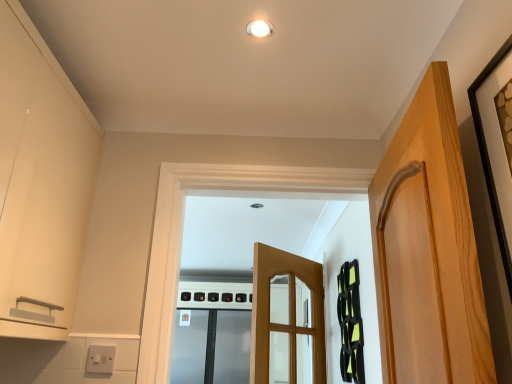
You are a GUI agent. You are given a task and a screenshot of the screen. Output one action in this format:
    pyautogui.click(x=<x>, y=<y>)
    Task: Click on the free space in front of white glossy light fixture at upper center
    This screenshot has height=384, width=512.
    Given the screenshot: What is the action you would take?
    pyautogui.click(x=265, y=7)